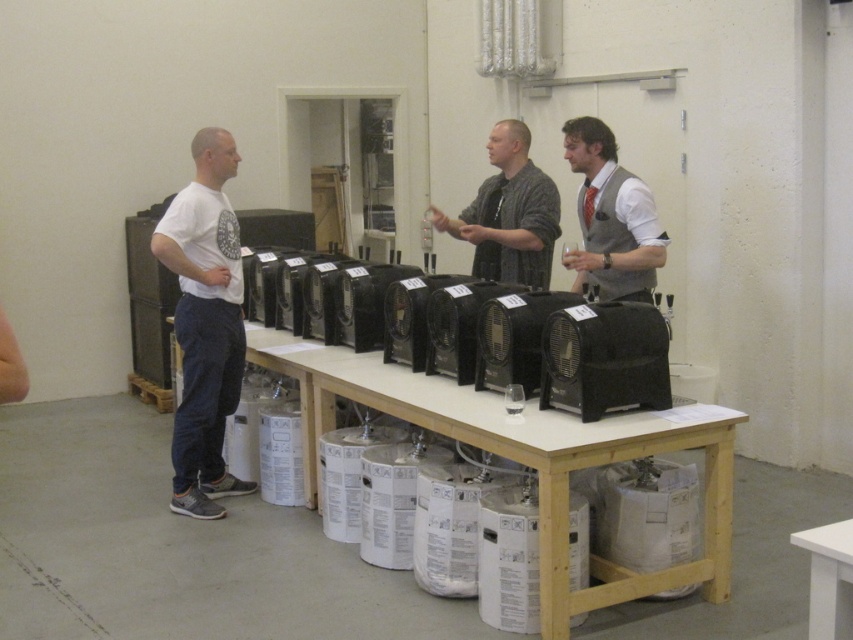
Question: Does matte gray shirt at center lie in front of white matte table at lower right?

Choices:
 (A) yes
 (B) no

Answer: (B)

Question: Can you confirm if wooden table at center is wider than matte gray vest at center?

Choices:
 (A) no
 (B) yes

Answer: (B)

Question: Which object is positioned farthest from the white t-shirt at left?

Choices:
 (A) matte gray shirt at center
 (B) white matte table at lower right
 (C) matte gray vest at center
 (D) wooden table at center

Answer: (B)

Question: Which point appears closest to the camera in this image?

Choices:
 (A) (845, 592)
 (B) (645, 288)
 (C) (306, 488)

Answer: (A)

Question: Is matte gray shirt at center smaller than white matte table at lower right?

Choices:
 (A) no
 (B) yes

Answer: (A)

Question: Which point is farther to the camera?

Choices:
 (A) matte gray shirt at center
 (B) white matte table at lower right
 (C) wooden table at center
 (D) matte gray vest at center

Answer: (A)